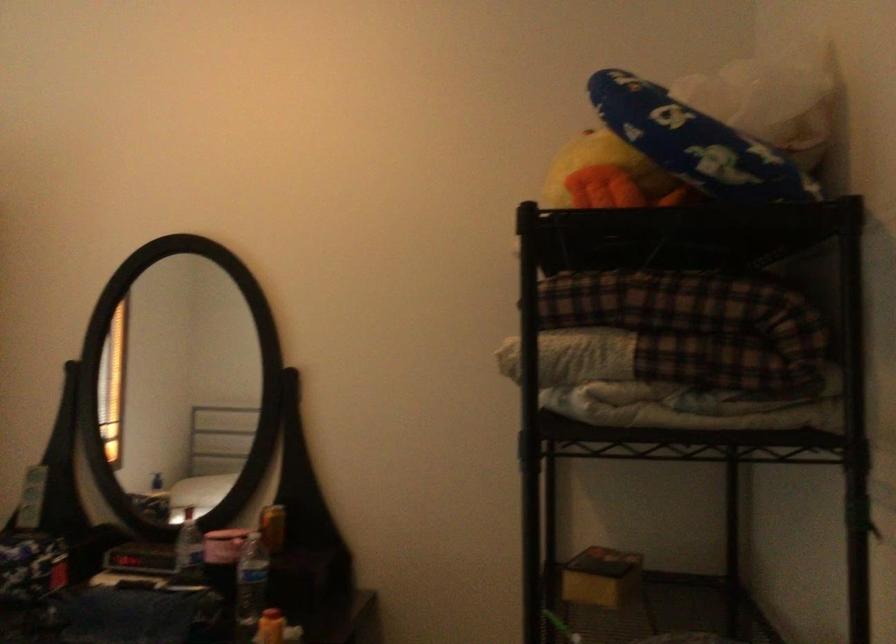
Locate an element on the screen. orange cap bottle is located at coordinates (270, 627).